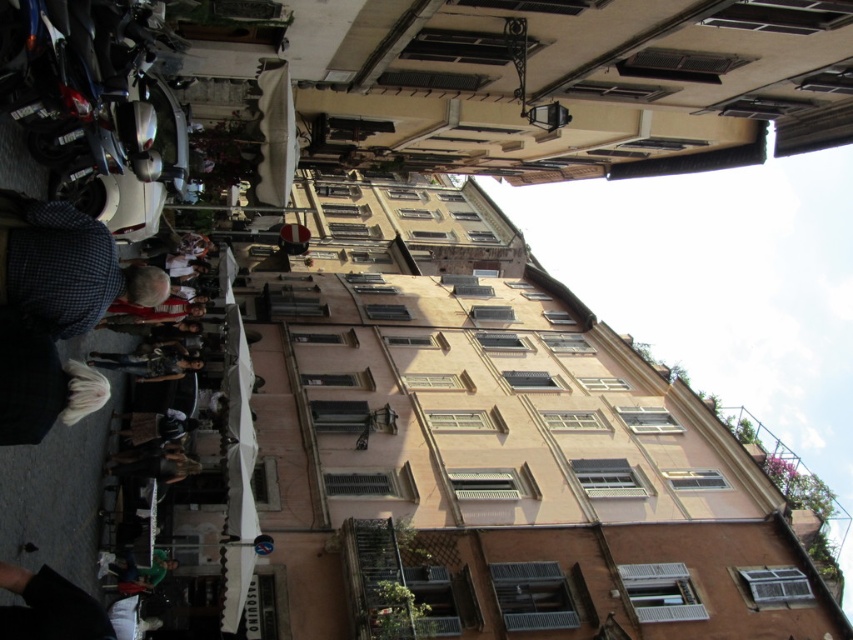
Who is more distant from viewer, (7, 241) or (144, 573)?

Point (144, 573)

Is point (84, 282) positioned after point (167, 564)?

No, (84, 282) is closer to viewer.

The width and height of the screenshot is (853, 640). I want to click on checkered fabric shirt at left, so click(x=64, y=268).